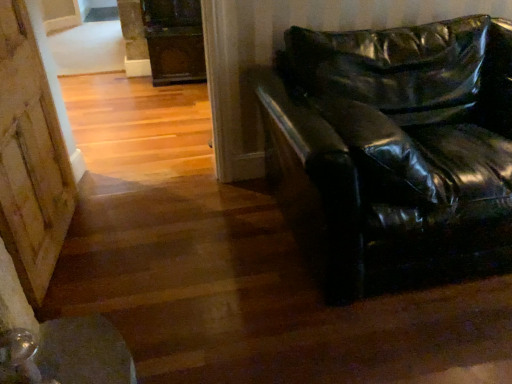
You are a GUI agent. You are given a task and a screenshot of the screen. Output one action in this format:
    pyautogui.click(x=<x>, y=<y>)
    Task: Click on the vacant region under wooden barn door at lower left (from a real-world perspective)
    The height and width of the screenshot is (384, 512).
    Given the screenshot: What is the action you would take?
    pyautogui.click(x=57, y=254)